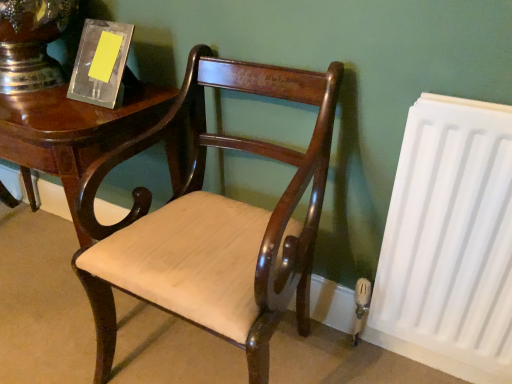
The width and height of the screenshot is (512, 384). I want to click on white matte radiator at right, so click(x=451, y=239).

Identify the location of radiator in front of the shiny dark wood table at left. The width and height of the screenshot is (512, 384). (451, 239).

Who is shorter, white matte radiator at right or shiny dark wood table at left?

shiny dark wood table at left.

Is white matte radiator at right not near shiny dark wood table at left?

No, there isn't a large distance between white matte radiator at right and shiny dark wood table at left.

Visually, is mahogany wood chair at center positioned to the left or to the right of white matte radiator at right?

In the image, mahogany wood chair at center appears on the left side of white matte radiator at right.

From a real-world perspective, is mahogany wood chair at center positioned under white matte radiator at right based on gravity?

No.

You are a GUI agent. You are given a task and a screenshot of the screen. Output one action in this format:
    pyautogui.click(x=<x>, y=<y>)
    Task: Click on the chair above the white matte radiator at right (from the image's perspective)
    This screenshot has height=384, width=512.
    Given the screenshot: What is the action you would take?
    pyautogui.click(x=213, y=225)

Considering the sizes of objects mahogany wood chair at center and white matte radiator at right in the image provided, who is wider, mahogany wood chair at center or white matte radiator at right?

mahogany wood chair at center.

Is shiny dark wood table at left positioned with its back to white matte radiator at right?

shiny dark wood table at left is not turned away from white matte radiator at right.

Are shiny dark wood table at left and white matte radiator at right located far from each other?

No, there isn't a large distance between shiny dark wood table at left and white matte radiator at right.

Between shiny dark wood table at left and white matte radiator at right, which one appears on the left side from the viewer's perspective?

shiny dark wood table at left.

Is point (75, 166) closer to camera compared to point (312, 153)?

No, (75, 166) is behind (312, 153).

Is shiny dark wood table at left directly adjacent to mahogany wood chair at center?

No, shiny dark wood table at left is not in contact with mahogany wood chair at center.

Find the location of `chair lying below the shiny dark wood table at left (from the image's perspective)`. chair lying below the shiny dark wood table at left (from the image's perspective) is located at coordinates (213, 225).

Does shiny dark wood table at left have a greater height compared to mahogany wood chair at center?

In fact, shiny dark wood table at left may be shorter than mahogany wood chair at center.

Considering the sizes of objects mahogany wood chair at center and shiny dark wood table at left in the image provided, who is thinner, mahogany wood chair at center or shiny dark wood table at left?

shiny dark wood table at left.

Can you confirm if mahogany wood chair at center is positioned to the right of shiny dark wood table at left?

Indeed, mahogany wood chair at center is positioned on the right side of shiny dark wood table at left.

Where is `table above the mahogany wood chair at center (from the image's perspective)`? table above the mahogany wood chair at center (from the image's perspective) is located at coordinates (73, 133).

Could you tell me if mahogany wood chair at center is facing shiny dark wood table at left?

No, mahogany wood chair at center is not aimed at shiny dark wood table at left.

Looking at this image, can you confirm if white matte radiator at right is positioned to the left of mahogany wood chair at center?

Incorrect, white matte radiator at right is not on the left side of mahogany wood chair at center.

Is white matte radiator at right far from mahogany wood chair at center?

That's not correct — white matte radiator at right is a little close to mahogany wood chair at center.

From their relative heights in the image, would you say white matte radiator at right is taller or shorter than mahogany wood chair at center?

white matte radiator at right is shorter than mahogany wood chair at center.

What's the angular difference between white matte radiator at right and mahogany wood chair at center's facing directions?

The angle between the facing direction of white matte radiator at right and the facing direction of mahogany wood chair at center is 0.75 degrees.

Identify the location of table behind the white matte radiator at right. Image resolution: width=512 pixels, height=384 pixels. (73, 133).

You are a GUI agent. You are given a task and a screenshot of the screen. Output one action in this format:
    pyautogui.click(x=<x>, y=<y>)
    Task: Click on the radiator lying on the right of mahogany wood chair at center
    Image resolution: width=512 pixels, height=384 pixels.
    Given the screenshot: What is the action you would take?
    pyautogui.click(x=451, y=239)

Looking at the image, which one is located closer to mahogany wood chair at center, white matte radiator at right or shiny dark wood table at left?

Based on the image, shiny dark wood table at left appears to be nearer to mahogany wood chair at center.

Based on their spatial positions, is shiny dark wood table at left or mahogany wood chair at center closer to white matte radiator at right?

Among the two, mahogany wood chair at center is located nearer to white matte radiator at right.

From the picture: Based on their spatial positions, is white matte radiator at right or mahogany wood chair at center closer to shiny dark wood table at left?

mahogany wood chair at center is positioned closer to the anchor shiny dark wood table at left.

Which object lies further to the anchor point mahogany wood chair at center, shiny dark wood table at left or white matte radiator at right?

white matte radiator at right is positioned further to the anchor mahogany wood chair at center.

From the image, which object appears to be farther from shiny dark wood table at left, mahogany wood chair at center or white matte radiator at right?

Among the two, white matte radiator at right is located further to shiny dark wood table at left.

Estimate the real-world distances between objects in this image. Which object is closer to white matte radiator at right, mahogany wood chair at center or shiny dark wood table at left?

mahogany wood chair at center lies closer to white matte radiator at right than the other object.

Find the location of `chair between shiny dark wood table at left and white matte radiator at right`. chair between shiny dark wood table at left and white matte radiator at right is located at coordinates (213, 225).